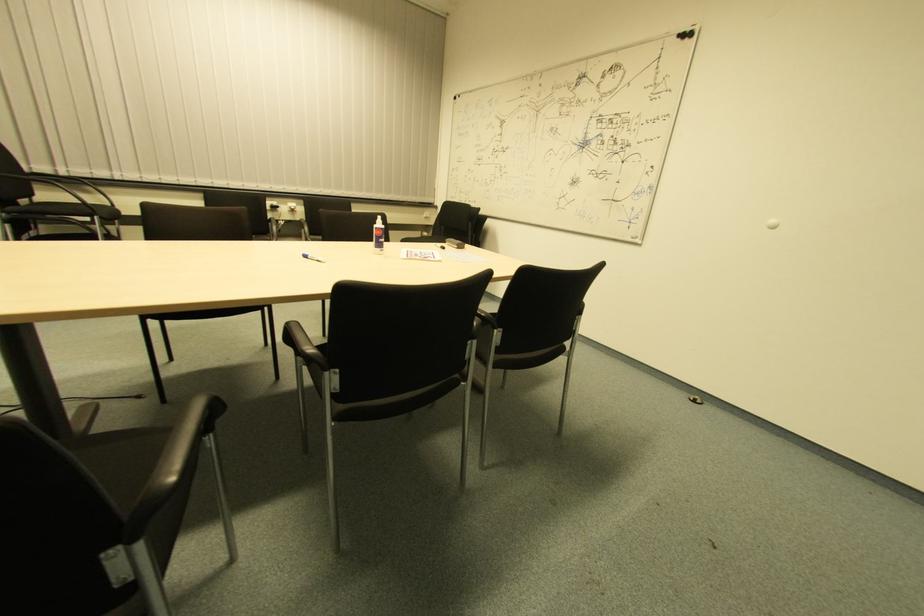
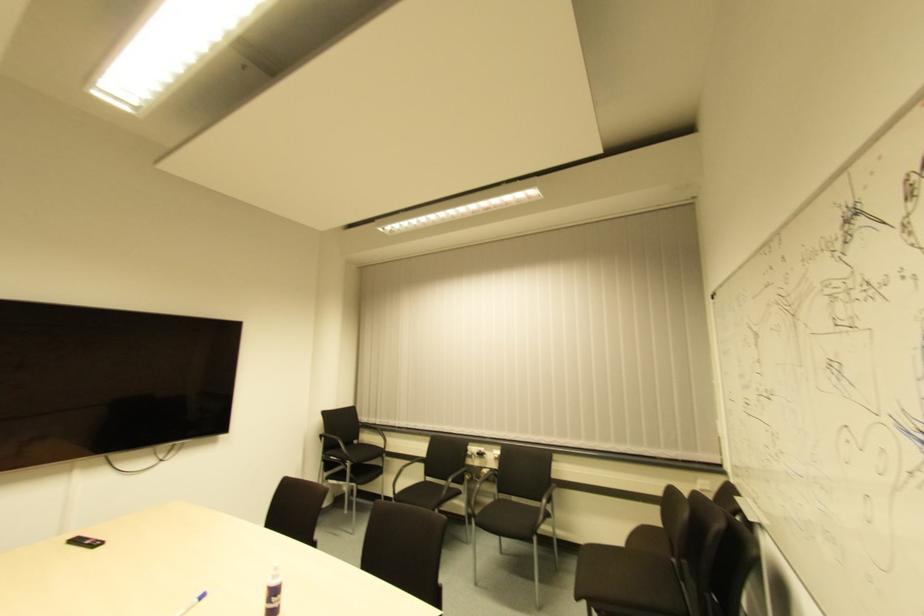
Where in the second image is the point corresponding to (x=107, y=209) from the first image?

(381, 448)